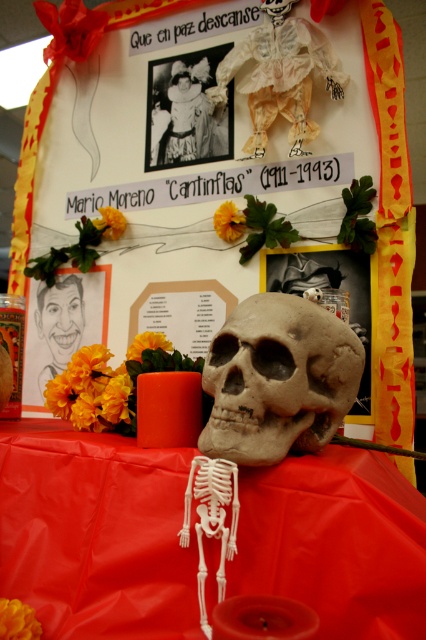
Question: Which point is closer to the camera?

Choices:
 (A) matte black caricature at center
 (B) gray matte skull at center
 (C) white paper doll at upper center
 (D) red fabric tablecloth at center

Answer: (D)

Question: Considering the real-world distances, which object is farthest from the red fabric tablecloth at center?

Choices:
 (A) gray matte skull at center
 (B) white paper doll at upper center
 (C) matte black caricature at center
 (D) matte black dress at center

Answer: (D)

Question: Is red fabric tablecloth at center behind matte black caricature at center?

Choices:
 (A) no
 (B) yes

Answer: (A)

Question: Which point appears closest to the camera in this image?

Choices:
 (A) (282, 540)
 (B) (204, 109)
 (C) (316, 444)
 (D) (270, 112)

Answer: (A)

Question: Can you confirm if red fabric tablecloth at center is positioned below matte black caricature at center?

Choices:
 (A) yes
 (B) no

Answer: (A)

Question: Can you confirm if red fabric tablecloth at center is smaller than matte black caricature at center?

Choices:
 (A) no
 (B) yes

Answer: (A)